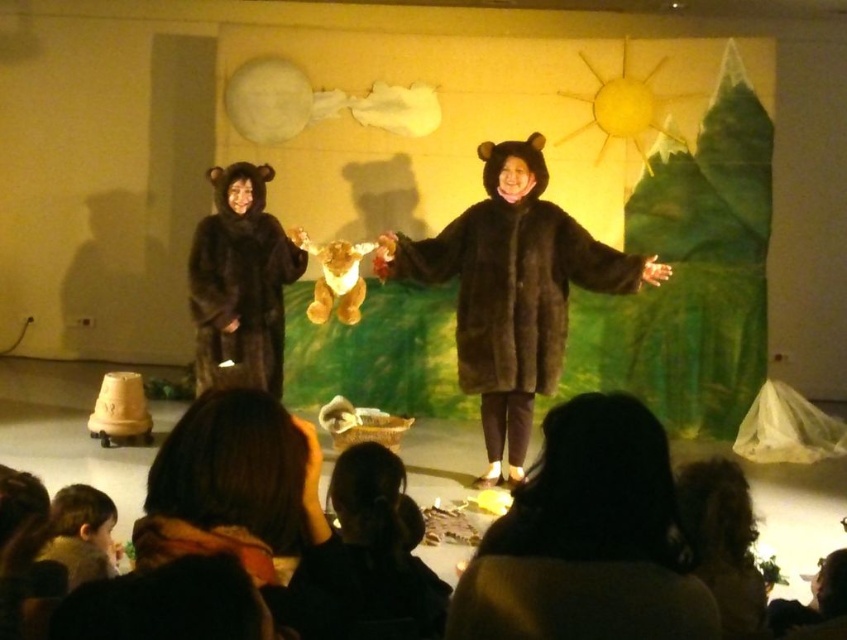
Question: Can you confirm if matte brown fur coat at center is thinner than dark brown hair at lower right?

Choices:
 (A) yes
 (B) no

Answer: (A)

Question: Which object is farther from the camera taking this photo?

Choices:
 (A) dark brown fur coat at lower center
 (B) black fuzzy coat at lower center

Answer: (B)

Question: Which point is farther to the camera?

Choices:
 (A) brown furry coat at center
 (B) dark brown hair at lower right

Answer: (A)

Question: Considering the relative positions of dark brown fur coat at lower center and fuzzy brown bear coat at left in the image provided, where is dark brown fur coat at lower center located with respect to fuzzy brown bear coat at left?

Choices:
 (A) left
 (B) right

Answer: (B)

Question: Among these objects, which one is farthest from the camera?

Choices:
 (A) matte brown fur coat at center
 (B) brown furry coat at center
 (C) dark brown hair at lower right

Answer: (A)

Question: Can you confirm if dark brown fur coat at lower center is positioned to the right of fuzzy brown bear coat at left?

Choices:
 (A) yes
 (B) no

Answer: (A)